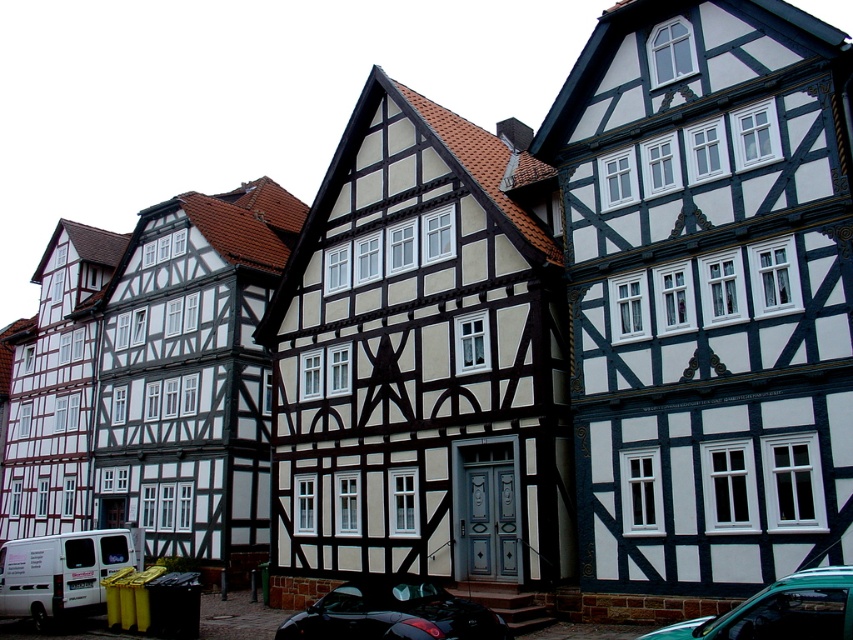
You are a delivery driver who needs to park your vehicle in this area. You have a truck that is the same size as the shiny black car at lower center. There is a parking spot next to the teal matte car at lower right. Will your truck fit in that parking spot?

The shiny black car at lower center is larger than the teal matte car at lower right. Since your truck is the same size as the shiny black car at lower center, it may not fit in the parking spot next to the teal matte car at lower right, which is likely sized for smaller vehicles like the teal matte car.

You are standing on the paved street in front of the row of traditional half timbered houses. You see a point marked at coordinates (x=393, y=612). What object is located at that point?

The point at (x=393, y=612) marks the location of a shiny black car at lower center.

You are a delivery person who needs to park your van between the shiny black car at lower center and the teal matte car at lower right. Can your van, which is 2.5 meters wide, fit in the space between them?

A: The shiny black car at lower center is wider than the teal matte car at lower right. Therefore, the space between them may not be sufficient for a van that is 2.5 meters wide unless the total available space exceeds this width. However, without exact measurements of the gap between the cars, it is impossible to definitively confirm if the van will fit.